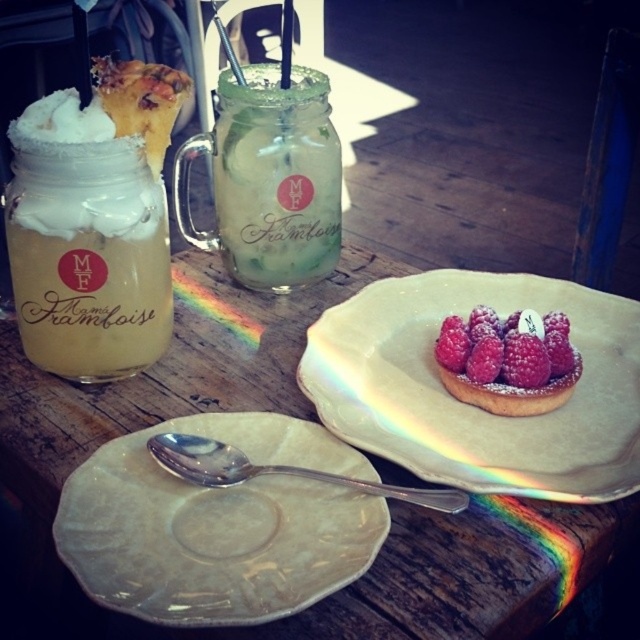
Does green glass jar at center have a smaller size compared to pink sugared tart at center?

Actually, green glass jar at center might be larger than pink sugared tart at center.

Which of these two, green glass jar at center or pink sugared tart at center, stands taller?

With more height is green glass jar at center.

This screenshot has height=640, width=640. Find the location of `green glass jar at center`. green glass jar at center is located at coordinates (268, 179).

I want to click on wooden table at center, so click(x=314, y=420).

Between wooden table at center and green glass jar at center, which one has more height?

wooden table at center is taller.

Image resolution: width=640 pixels, height=640 pixels. In order to click on wooden table at center in this screenshot , I will do `click(314, 420)`.

Image resolution: width=640 pixels, height=640 pixels. I want to click on wooden table at center, so click(x=314, y=420).

Does wooden table at center have a greater height compared to powdered sugar tart at center?

Yes, wooden table at center is taller than powdered sugar tart at center.

The height and width of the screenshot is (640, 640). Describe the element at coordinates (314, 420) in the screenshot. I see `wooden table at center` at that location.

You are a GUI agent. You are given a task and a screenshot of the screen. Output one action in this format:
    pyautogui.click(x=<x>, y=<y>)
    Task: Click on the wooden table at center
    Image resolution: width=640 pixels, height=640 pixels.
    Given the screenshot: What is the action you would take?
    pyautogui.click(x=314, y=420)